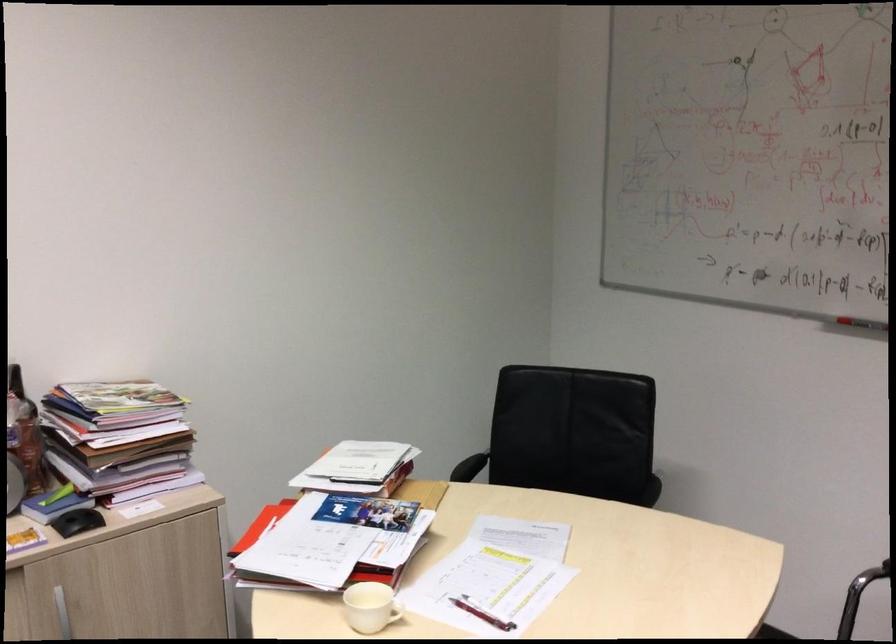
Find where to resting arm the chair armrest. Please return your answer as a coordinate pair (x, y).

(469, 468)